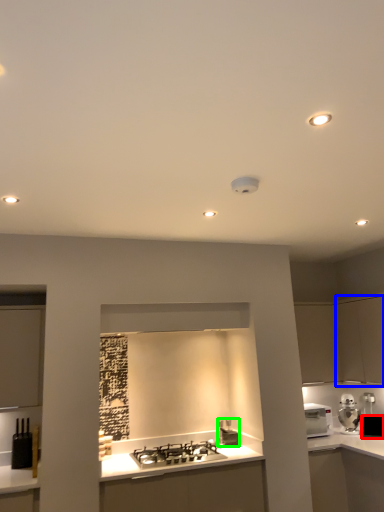
Question: Which is nearer to the appliance (highlighted by a red box)? cabinetry (highlighted by a blue box) or appliance (highlighted by a green box).

Choices:
 (A) cabinetry
 (B) appliance

Answer: (A)